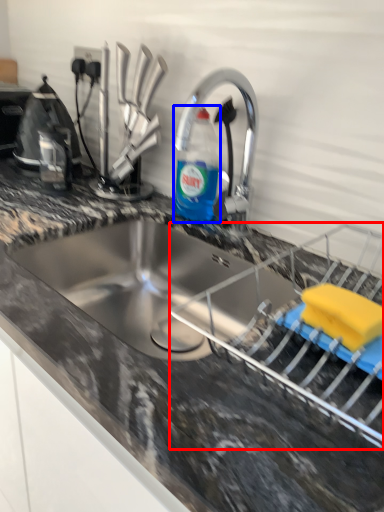
Question: Among these objects, which one is nearest to the camera, appliance (highlighted by a red box) or bottle (highlighted by a blue box)?

Choices:
 (A) appliance
 (B) bottle

Answer: (A)